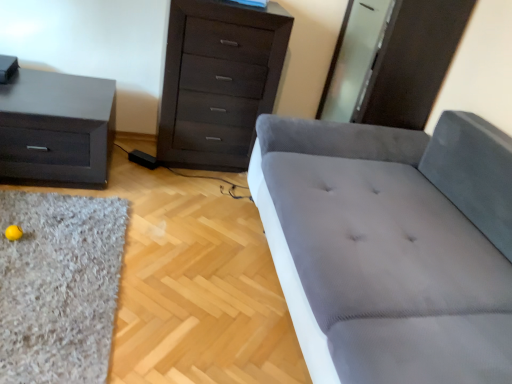
I want to click on vacant area that lies between dark wood chest of drawers at upper center and matte black nightstand at left, so (155, 176).